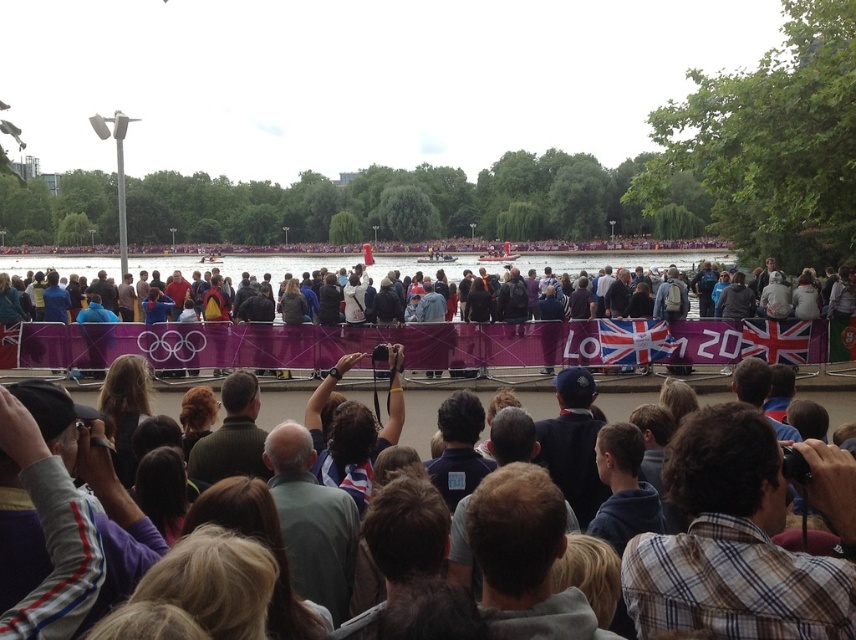
You are standing at the point labeled point (64, 291) and want to take a photo of the Olympic rings in the foreground. To do this, you need to move to a position where you can see the Olympic rings clearly without any obstructions. Which direction should you move relative to point (609, 484)?

You should move towards point (609, 484) because it is in front of point (64, 291), meaning moving towards it would place you closer to the Olympic rings and away from potential obstructions behind point (64, 291).

You are a photographer standing at the front of the crowd at this London 2012 event. You want to take a photo of the Olympic rings in the foreground but need to ensure you can step forward enough to frame them properly. Given that your camera requires a minimum of 50 feet of space to focus properly, is the blue fleece jacket at center currently blocking your path?

The blue fleece jacket at center is 71.43 feet away from the camera, which means there is sufficient space between you and the jacket to step forward and frame the Olympic rings without obstruction.

You are a photographer at the London 2012 Olympics event. You want to take a photo of the Olympic rings in the foreground and the distant trees. You have two points marked on your camera screen, point 1 at point (586, 637) and point 2 at point (360, 500). Which point should you focus on to ensure both the Olympic rings and the distant trees are in focus?

You should focus on point 1 at point (586, 637) because it is closer to the camera than point 2 at point (360, 500). This allows the Olympic rings in the foreground and the distant trees to be in focus.